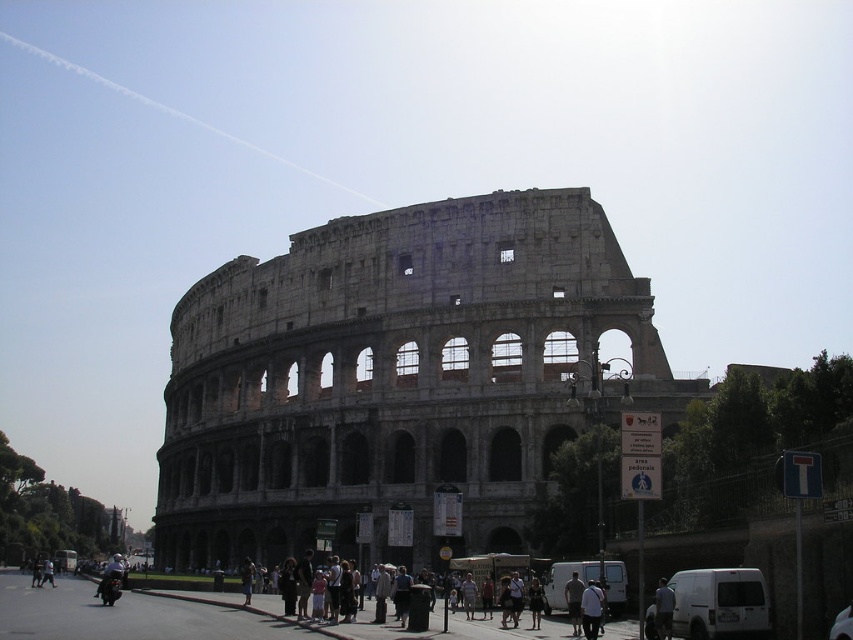
Can you confirm if light blue shirt at center is positioned to the right of light brown leather jacket at center?

Yes, light blue shirt at center is to the right of light brown leather jacket at center.

Is point (669, 602) farther from camera compared to point (573, 586)?

No, it is in front of (573, 586).

Who is more distant from viewer, (665, 634) or (573, 620)?

Point (573, 620)

The height and width of the screenshot is (640, 853). Identify the location of light blue shirt at center. (663, 609).

Is point (268, 436) more distant than point (567, 598)?

Yes, it is behind point (567, 598).

This screenshot has height=640, width=853. I want to click on gray stone amphitheater at center, so coord(395,378).

Can you confirm if gray stone amphitheater at center is positioned below light blue shirt at center?

Incorrect, gray stone amphitheater at center is not positioned below light blue shirt at center.

Between gray stone amphitheater at center and light blue shirt at center, which one is positioned higher?

gray stone amphitheater at center

Image resolution: width=853 pixels, height=640 pixels. What do you see at coordinates (395, 378) in the screenshot?
I see `gray stone amphitheater at center` at bounding box center [395, 378].

Locate an element on the screen. gray stone amphitheater at center is located at coordinates (395, 378).